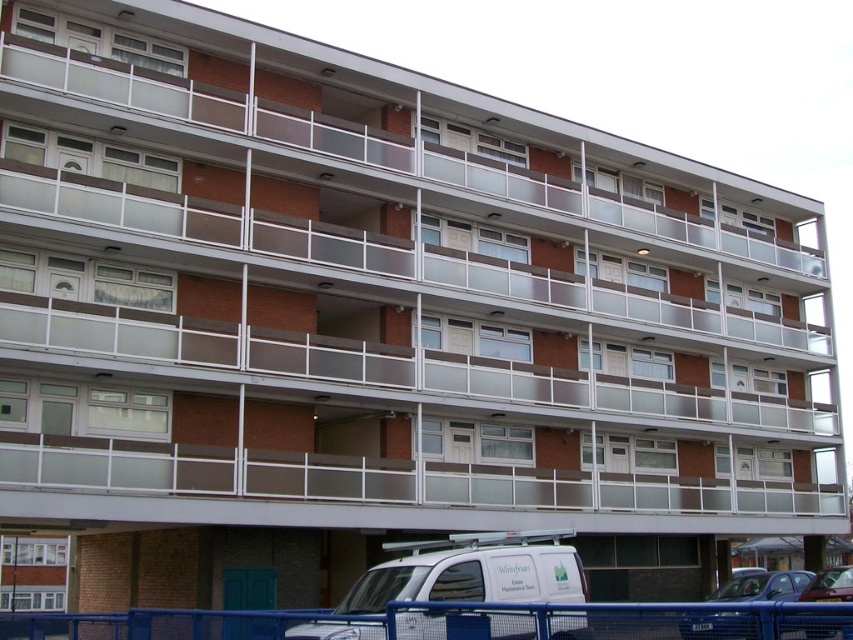
You are standing in front of the residential building and notice a metallic blue car at lower right. Based on its coordinates, is the car closer to the building or the street?

The metallic blue car at lower right is located at point (x=762, y=586), which places it closer to the street since lower coordinates typically indicate proximity to the foreground elements like the street in the scene.

Looking at this image, you are a delivery person approaching the building and need to park your vehicle. You see a metallic blue car at lower right and a metallic silver car at lower right. Which car is closer to the entrance of the building?

The metallic blue car at lower right is closer to the entrance of the building because the metallic silver car at lower right is behind it.